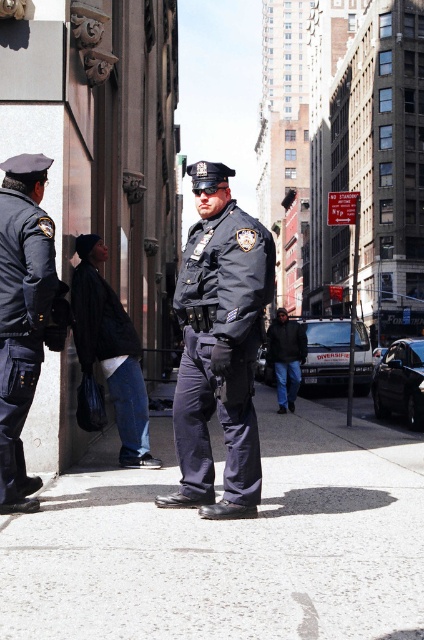
How far apart are black matte jacket at lower left and dark blue jeans at center?

They are 9.10 meters apart.

Where is `black matte jacket at lower left`? black matte jacket at lower left is located at coordinates (111, 355).

Find the location of a particular element. Image resolution: width=424 pixels, height=640 pixels. black matte jacket at lower left is located at coordinates point(111,355).

Who is positioned more to the right, gray concrete sidewalk at center or dark blue uniform at center?

gray concrete sidewalk at center

Is gray concrete sidewalk at center smaller than dark blue uniform at center?

Incorrect, gray concrete sidewalk at center is not smaller in size than dark blue uniform at center.

At what (x,y) coordinates should I click in order to perform the action: click on gray concrete sidewalk at center. Please return your answer as a coordinate pair (x, y). Looking at the image, I should click on (228, 544).

Which is behind, point (339, 424) or point (282, 323)?

The point (282, 323) is more distant.

Is gray concrete sidewalk at center taller than dark blue jeans at center?

No.

The image size is (424, 640). What do you see at coordinates (228, 544) in the screenshot?
I see `gray concrete sidewalk at center` at bounding box center [228, 544].

Where is `gray concrete sidewalk at center`? This screenshot has width=424, height=640. gray concrete sidewalk at center is located at coordinates (228, 544).